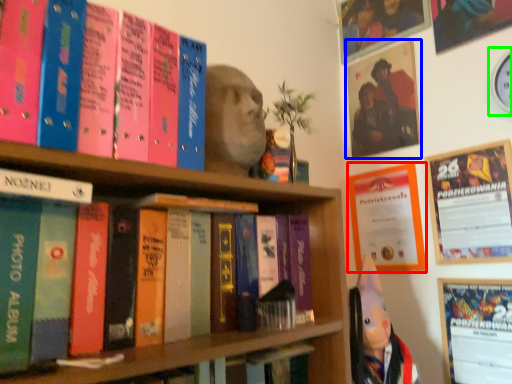
Question: Considering the real-world distances, which object is farthest from poster page (highlighted by a red box)? picture frame (highlighted by a blue box) or clock (highlighted by a green box)?

Choices:
 (A) picture frame
 (B) clock

Answer: (B)